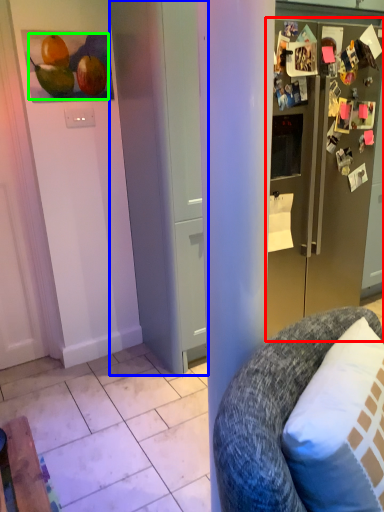
Question: Which object is positioned farthest from refrigerator (highlighted by a red box)? Select from door (highlighted by a blue box) and fruit (highlighted by a green box).

Choices:
 (A) door
 (B) fruit

Answer: (B)